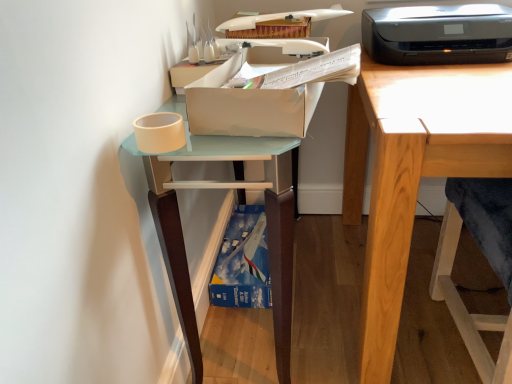
Question: Does black plastic printer at upper right have a larger size compared to matte white shelf at left?

Choices:
 (A) yes
 (B) no

Answer: (B)

Question: From the image's perspective, is black plastic printer at upper right over matte white shelf at left?

Choices:
 (A) yes
 (B) no

Answer: (A)

Question: From a real-world perspective, is black plastic printer at upper right physically below matte white shelf at left?

Choices:
 (A) no
 (B) yes

Answer: (A)

Question: Is black plastic printer at upper right further to camera compared to matte white shelf at left?

Choices:
 (A) no
 (B) yes

Answer: (B)

Question: Would you consider black plastic printer at upper right to be distant from matte white shelf at left?

Choices:
 (A) yes
 (B) no

Answer: (B)

Question: Considering the positions of black plastic printer at upper right and cardboard box at upper center in the image, is black plastic printer at upper right bigger or smaller than cardboard box at upper center?

Choices:
 (A) small
 (B) big

Answer: (B)

Question: Is black plastic printer at upper right wider or thinner than cardboard box at upper center?

Choices:
 (A) wide
 (B) thin

Answer: (A)

Question: From the image's perspective, is black plastic printer at upper right above or below cardboard box at upper center?

Choices:
 (A) below
 (B) above

Answer: (B)

Question: Would you say black plastic printer at upper right is to the left or to the right of cardboard box at upper center in the picture?

Choices:
 (A) right
 (B) left

Answer: (A)

Question: From the image's perspective, is matte white shelf at left located above or below wooden desk at right?

Choices:
 (A) below
 (B) above

Answer: (A)

Question: From a real-world perspective, is matte white shelf at left physically located above or below wooden desk at right?

Choices:
 (A) above
 (B) below

Answer: (B)

Question: Relative to wooden desk at right, is matte white shelf at left in front or behind?

Choices:
 (A) front
 (B) behind

Answer: (B)

Question: From their relative heights in the image, would you say matte white shelf at left is taller or shorter than wooden desk at right?

Choices:
 (A) short
 (B) tall

Answer: (A)

Question: In terms of height, does wooden folding chair at right look taller or shorter compared to wooden desk at right?

Choices:
 (A) short
 (B) tall

Answer: (B)

Question: From the image's perspective, is wooden folding chair at right above or below wooden desk at right?

Choices:
 (A) above
 (B) below

Answer: (B)